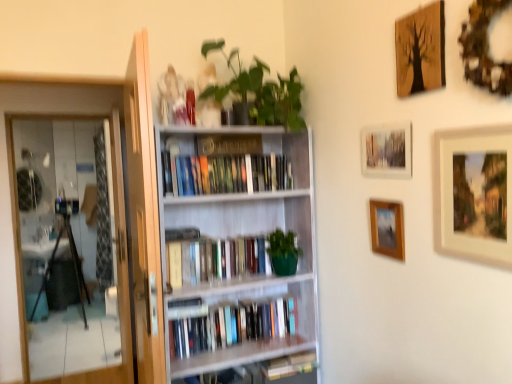
Question: Is wooden picture frame at center-right, the first picture frame ordered from the bottom, located outside transparent glass screen door at left?

Choices:
 (A) no
 (B) yes

Answer: (B)

Question: Could you tell me if wooden picture frame at center-right, positioned as the fourth picture frame in top-to-bottom order, is turned towards transparent glass screen door at left?

Choices:
 (A) yes
 (B) no

Answer: (B)

Question: Considering the relative sizes of wooden picture frame at center-right, the first picture frame ordered from the bottom, and transparent glass screen door at left in the image provided, is wooden picture frame at center-right, the first picture frame ordered from the bottom, shorter than transparent glass screen door at left?

Choices:
 (A) yes
 (B) no

Answer: (A)

Question: Is wooden picture frame at center-right, the first picture frame ordered from the bottom, at the right side of transparent glass screen door at left?

Choices:
 (A) yes
 (B) no

Answer: (A)

Question: Is white wooden bookcase at center in front of or behind green matte plant at upper center in the image?

Choices:
 (A) behind
 (B) front

Answer: (A)

Question: From a real-world perspective, is white wooden bookcase at center positioned above or below green matte plant at upper center?

Choices:
 (A) below
 (B) above

Answer: (A)

Question: Considering the positions of white wooden bookcase at center and green matte plant at upper center in the image, is white wooden bookcase at center taller or shorter than green matte plant at upper center?

Choices:
 (A) tall
 (B) short

Answer: (A)

Question: Considering the positions of white wooden bookcase at center and green matte plant at upper center in the image, is white wooden bookcase at center wider or thinner than green matte plant at upper center?

Choices:
 (A) thin
 (B) wide

Answer: (A)

Question: From the image's perspective, is wooden framed photo at upper center, which is the 2th picture frame in top-to-bottom order, located above or below wooden framed painting at upper right, which is counted as the second picture frame, starting from the bottom?

Choices:
 (A) below
 (B) above

Answer: (B)

Question: Is point (373, 162) positioned closer to the camera than point (476, 157)?

Choices:
 (A) closer
 (B) farther

Answer: (B)

Question: Which is correct: wooden framed photo at upper center, marked as the 3th picture frame in a bottom-to-top arrangement, is inside wooden framed painting at upper right, which is counted as the 3th picture frame, starting from the top, or outside of it?

Choices:
 (A) outside
 (B) inside

Answer: (A)

Question: In terms of height, does wooden framed photo at upper center, marked as the 3th picture frame in a bottom-to-top arrangement, look taller or shorter compared to wooden framed painting at upper right, which is counted as the 3th picture frame, starting from the top?

Choices:
 (A) short
 (B) tall

Answer: (A)

Question: From the image's perspective, is green matte plant at upper center positioned above or below wooden textured picture frame at upper right, arranged as the first picture frame when viewed from the top?

Choices:
 (A) above
 (B) below

Answer: (A)

Question: Based on their sizes in the image, would you say green matte plant at upper center is bigger or smaller than wooden textured picture frame at upper right, arranged as the first picture frame when viewed from the top?

Choices:
 (A) big
 (B) small

Answer: (A)